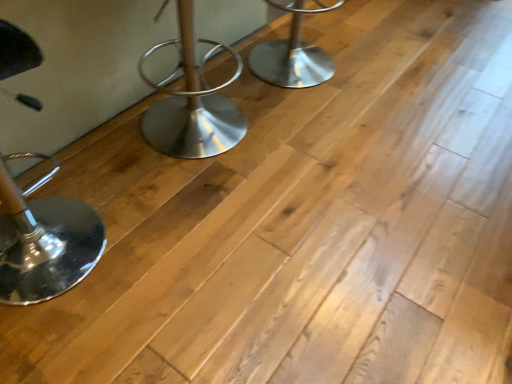
Question: Is polished chrome stool at left, which is the second furniture in back-to-front order, smaller than polished metal stool at center, the first furniture when ordered from top to bottom?

Choices:
 (A) no
 (B) yes

Answer: (A)

Question: Is polished chrome stool at left, which is the 2th furniture in right-to-left order, positioned behind polished metal stool at center, which ranks as the 2th furniture in front-to-back order?

Choices:
 (A) yes
 (B) no

Answer: (B)

Question: Is polished chrome stool at left, which is the 2th furniture in right-to-left order, wider than polished metal stool at center, which is counted as the 1th furniture, starting from the back?

Choices:
 (A) yes
 (B) no

Answer: (B)

Question: Does polished chrome stool at left, the second furniture positioned from the top, come in front of polished metal stool at center, which appears as the 1th furniture when viewed from the right?

Choices:
 (A) yes
 (B) no

Answer: (A)

Question: Is polished chrome stool at left, marked as the first furniture in a bottom-to-top arrangement, at the left side of polished metal stool at center, which ranks as the 2th furniture in front-to-back order?

Choices:
 (A) yes
 (B) no

Answer: (A)

Question: From the image's perspective, is polished chrome stool at left, the second furniture positioned from the top, below polished metal stool at center, the first furniture when ordered from top to bottom?

Choices:
 (A) no
 (B) yes

Answer: (B)

Question: From a real-world perspective, is polished metal stool at center, which is counted as the 1th furniture, starting from the back, under polished chrome stool at left, which is the 2th furniture in right-to-left order?

Choices:
 (A) yes
 (B) no

Answer: (A)

Question: Does polished metal stool at center, which appears as the 1th furniture when viewed from the right, appear on the left side of polished chrome stool at left, the second furniture positioned from the top?

Choices:
 (A) yes
 (B) no

Answer: (B)

Question: Considering the relative sizes of polished metal stool at center, which is counted as the 1th furniture, starting from the back, and polished chrome stool at left, which appears as the 1th furniture when viewed from the front, in the image provided, is polished metal stool at center, which is counted as the 1th furniture, starting from the back, smaller than polished chrome stool at left, which appears as the 1th furniture when viewed from the front,?

Choices:
 (A) no
 (B) yes

Answer: (B)

Question: Is polished metal stool at center, the first furniture when ordered from top to bottom, wider than polished chrome stool at left, which is the 2th furniture in right-to-left order?

Choices:
 (A) yes
 (B) no

Answer: (A)

Question: Is polished chrome stool at left, which is the second furniture in back-to-front order, at the back of polished metal stool at center, which appears as the 1th furniture when viewed from the right?

Choices:
 (A) no
 (B) yes

Answer: (A)

Question: Are polished metal stool at center, the second furniture positioned from the left, and polished chrome stool at left, which appears as the 1th furniture when viewed from the front, making contact?

Choices:
 (A) no
 (B) yes

Answer: (A)

Question: Looking at the image, does polished chrome stool at left, the second furniture positioned from the top, seem bigger or smaller compared to polished metal stool at center, which appears as the 1th furniture when viewed from the right?

Choices:
 (A) small
 (B) big

Answer: (B)